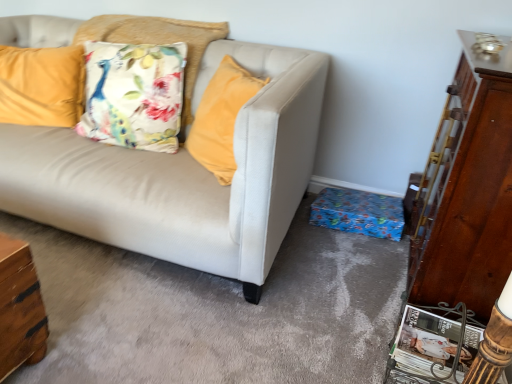
Question: Do you think floral fabric pillow at upper left, which is the 2th pillow from left to right, is within velvet yellow pillow at upper left, the 2th pillow in the right-to-left sequence, or outside of it?

Choices:
 (A) inside
 (B) outside

Answer: (B)

Question: Considering the positions of point (188, 119) and point (22, 59), is point (188, 119) closer or farther from the camera than point (22, 59)?

Choices:
 (A) farther
 (B) closer

Answer: (B)

Question: Which is farther from the floral fabric pillow at upper left, the first pillow viewed from the right?

Choices:
 (A) velvet yellow pillow at upper left, the 1th pillow from the left
 (B) wooden dresser at right

Answer: (B)

Question: Based on their relative distances, which object is farther from the floral fabric pillow at upper left, which is the 2th pillow from left to right?

Choices:
 (A) velvet yellow pillow at upper left, the 2th pillow in the right-to-left sequence
 (B) wooden dresser at right

Answer: (B)